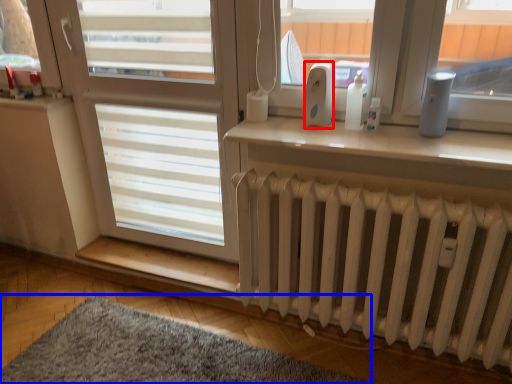
Question: Which of the following is the farthest to the observer, appliance (highlighted by a red box) or mat (highlighted by a blue box)?

Choices:
 (A) appliance
 (B) mat

Answer: (A)